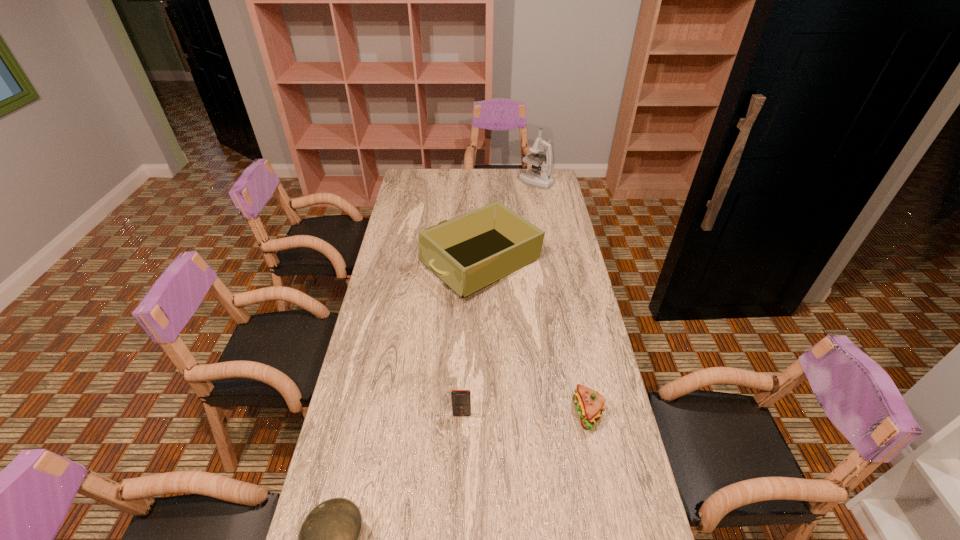
In order to click on vacant space that is in between the cellular telephone and the tallest object in this screenshot , I will do `click(499, 298)`.

Find the location of a particular element. free spot between the sandwich and the tallest object is located at coordinates (562, 298).

Locate an element on the screen. This screenshot has height=540, width=960. blank region between the box and the fourth tallest object is located at coordinates (535, 339).

I want to click on free area in between the sandwich and the cellular telephone, so click(525, 414).

This screenshot has width=960, height=540. Find the location of `free area in between the microscope and the cellular telephone`. free area in between the microscope and the cellular telephone is located at coordinates (499, 298).

Find the location of a particular element. vacant space that is in between the fourth nearest object and the sandwich is located at coordinates (535, 339).

In order to click on free space between the sandwich and the box in this screenshot , I will do `click(535, 339)`.

Identify which object is the closest to the fourth shortest object. Please provide its 2D coordinates. Your answer should be formatted as a tuple, i.e. [(x, y)], where the tuple contains the x and y coordinates of a point satisfying the conditions above.

[(543, 179)]

In order to click on object that stands as the fourth closest to the second farthest object in this screenshot , I will do `click(328, 539)`.

Identify the location of vacant area that satisfies the following two spatial constraints: 1. on the front side of the fourth nearest object; 2. on the left side of the sandwich. (482, 413).